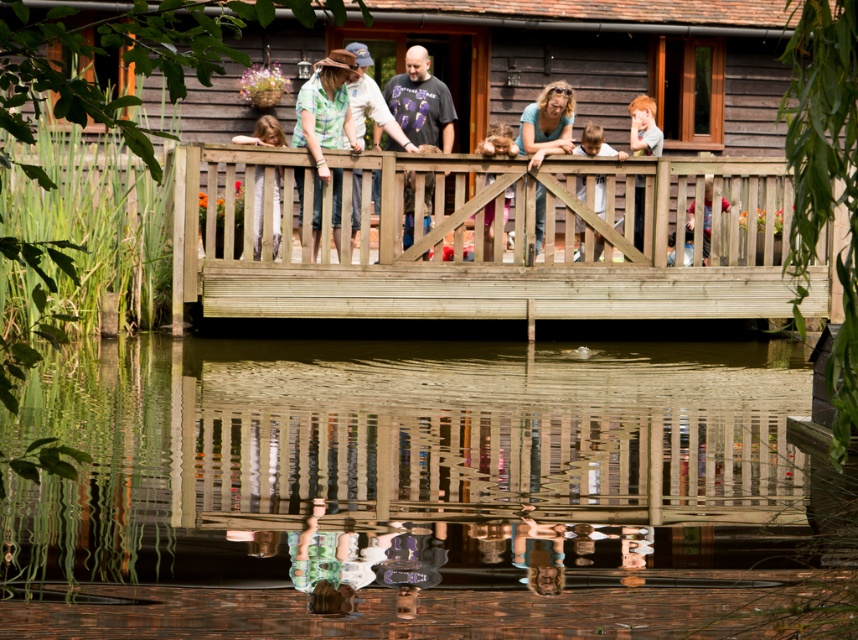
Between matte teal shirt at center and pink fabric at center, which one appears on the left side from the viewer's perspective?

From the viewer's perspective, pink fabric at center appears more on the left side.

Is matte teal shirt at center shorter than pink fabric at center?

Incorrect, matte teal shirt at center's height does not fall short of pink fabric at center's.

Find the location of a particular element. The height and width of the screenshot is (640, 858). matte teal shirt at center is located at coordinates (547, 124).

This screenshot has height=640, width=858. What are the coordinates of `matte teal shirt at center` in the screenshot? It's located at (547, 124).

Between point (305, 138) and point (686, 224), which one is positioned behind?

Point (686, 224)

Does green tie-dye shirt at center have a greater width compared to light brown wooden fence post at center?

Indeed, green tie-dye shirt at center has a greater width compared to light brown wooden fence post at center.

The image size is (858, 640). Describe the element at coordinates (324, 122) in the screenshot. I see `green tie-dye shirt at center` at that location.

The width and height of the screenshot is (858, 640). I want to click on green tie-dye shirt at center, so click(x=324, y=122).

Is green tie-dye shirt at center shorter than dark gray t-shirt at center?

Incorrect, green tie-dye shirt at center's height does not fall short of dark gray t-shirt at center's.

Is point (317, 202) behind point (442, 108)?

No.

Is point (337, 196) positioned before point (409, 93)?

Yes.

At what (x,y) coordinates should I click in order to perform the action: click on green tie-dye shirt at center. Please return your answer as a coordinate pair (x, y). The width and height of the screenshot is (858, 640). Looking at the image, I should click on pyautogui.click(x=324, y=122).